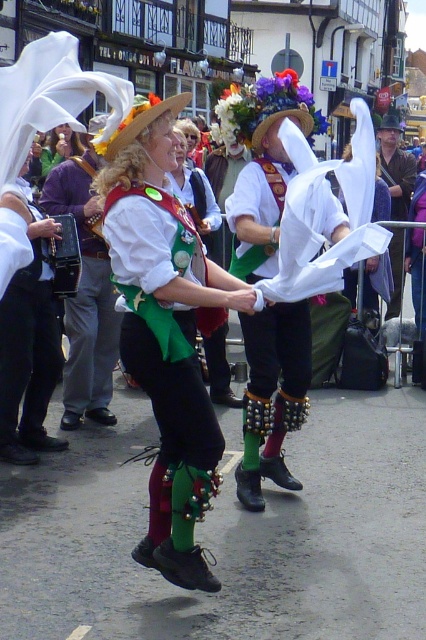
You are organizing a costume party and want to ensure that the green velvet vest at center and the brown leather jacket at center fit the performers. Given that the performers are of average size, which of these two items is more likely to require alterations?

The brown leather jacket at center is larger than the green velvet vest at center, so it might require alterations for average size performers.

You are a photographer standing in the middle of the street, and you want to take a photo of both the green velvet vest at center and the brown leather jacket at center. Which one will appear larger in your photo?

The green velvet vest at center will appear larger in the photo because it is closer to the viewer than the brown leather jacket at center.

You are a costume designer observing the dancers in the festival scene. You need to determine which garment is shorter between the green velvet vest at center and the brown leather jacket at center. Which one is shorter?

The green velvet vest at center is shorter than the brown leather jacket at center according to the description.